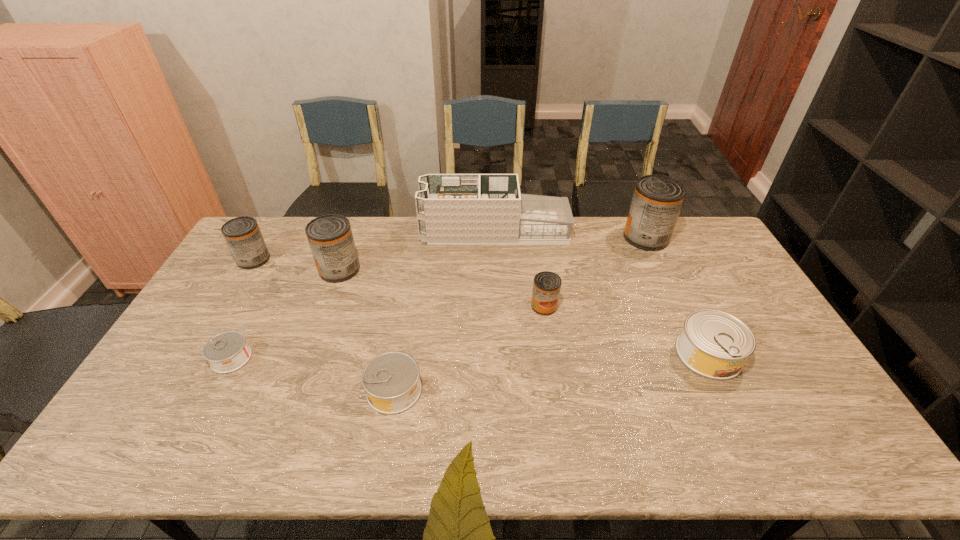
Identify the location of the second shortest object. (391, 380).

The height and width of the screenshot is (540, 960). Identify the location of the second biggest silver can. (391, 380).

Locate an element on the screen. the leftmost silver can is located at coordinates (226, 352).

Identify the location of the shortest can. (226, 352).

I want to click on vacant area situated on the front of the rightmost red can, so click(x=669, y=288).

Where is `vacant area situated at the entrance of the dollhouse`? The width and height of the screenshot is (960, 540). vacant area situated at the entrance of the dollhouse is located at coordinates (361, 231).

You are a GUI agent. You are given a task and a screenshot of the screen. Output one action in this format:
    pyautogui.click(x=<x>, y=<y>)
    Task: Click on the vacant position located 0.090m at the entrance of the dollhouse
    This screenshot has width=960, height=540.
    Given the screenshot: What is the action you would take?
    pyautogui.click(x=397, y=231)

The image size is (960, 540). Find the location of `free location located at the entrance of the dollhouse`. free location located at the entrance of the dollhouse is located at coordinates (332, 231).

At what (x,y) coordinates should I click in order to perform the action: click on free space located on the back of the second tallest can. Please return your answer as a coordinate pair (x, y). The image size is (960, 540). Looking at the image, I should click on (357, 221).

The image size is (960, 540). I want to click on free space located 0.130m on the right of the third biggest red can, so click(x=306, y=259).